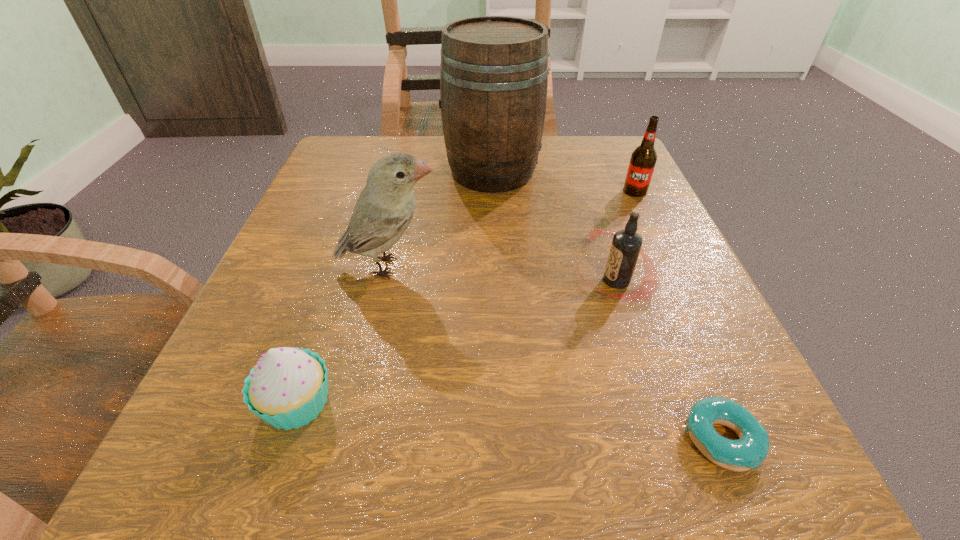
Image resolution: width=960 pixels, height=540 pixels. I want to click on doughnut located in the near edge section of the desktop, so click(751, 449).

This screenshot has width=960, height=540. I want to click on bird positioned at the left edge, so click(x=385, y=207).

The width and height of the screenshot is (960, 540). Identify the location of cupcake at the left edge. (287, 388).

This screenshot has height=540, width=960. Identify the location of doughnut that is at the right edge. (751, 449).

Where is `object that is at the near left corner`? The height and width of the screenshot is (540, 960). object that is at the near left corner is located at coordinates (287, 388).

Where is `object that is positioned at the far right corner`? object that is positioned at the far right corner is located at coordinates (643, 159).

The image size is (960, 540). What are the coordinates of `object located in the near right corner section of the desktop` in the screenshot? It's located at (751, 449).

The image size is (960, 540). What are the coordinates of `vacant region at the far edge` in the screenshot? It's located at (429, 144).

In the image, there is a desktop. Where is `free space at the near edge`? The height and width of the screenshot is (540, 960). free space at the near edge is located at coordinates (540, 453).

You are a GUI agent. You are given a task and a screenshot of the screen. Output one action in this format:
    pyautogui.click(x=<x>, y=<y>)
    Task: Click on the free point at the left edge
    This screenshot has height=540, width=960.
    Given the screenshot: What is the action you would take?
    pyautogui.click(x=324, y=264)